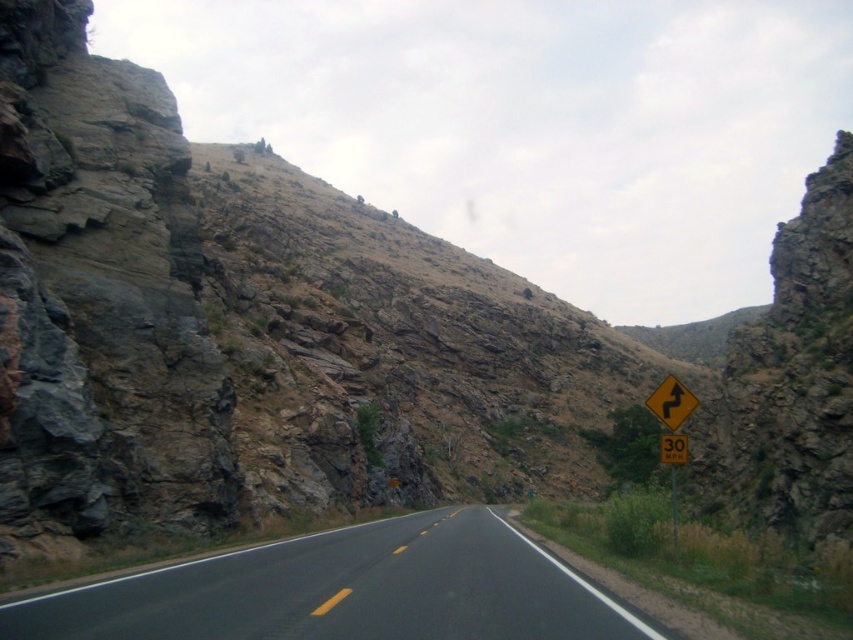
Between yellow reflective plastic at right and yellow plastic speed limit sign at center, which one has less height?

yellow plastic speed limit sign at center

From the picture: Is yellow reflective plastic at right above yellow plastic speed limit sign at center?

Incorrect, yellow reflective plastic at right is not positioned above yellow plastic speed limit sign at center.

Between point (651, 394) and point (672, 449), which one is positioned behind?

Point (651, 394)

Locate an element on the screen. yellow reflective plastic at right is located at coordinates (672, 433).

Is yellow reflective plastic at right above yellow reflective plastic at center?

No, yellow reflective plastic at right is not above yellow reflective plastic at center.

This screenshot has height=640, width=853. What do you see at coordinates (672, 433) in the screenshot? I see `yellow reflective plastic at right` at bounding box center [672, 433].

Image resolution: width=853 pixels, height=640 pixels. In order to click on yellow reflective plastic at right in this screenshot , I will do `click(672, 433)`.

Can you confirm if black asphalt road at center is taller than yellow reflective plastic at right?

No.

Which is above, black asphalt road at center or yellow reflective plastic at right?

black asphalt road at center is above.

What do you see at coordinates (345, 589) in the screenshot? I see `black asphalt road at center` at bounding box center [345, 589].

This screenshot has width=853, height=640. I want to click on black asphalt road at center, so click(345, 589).